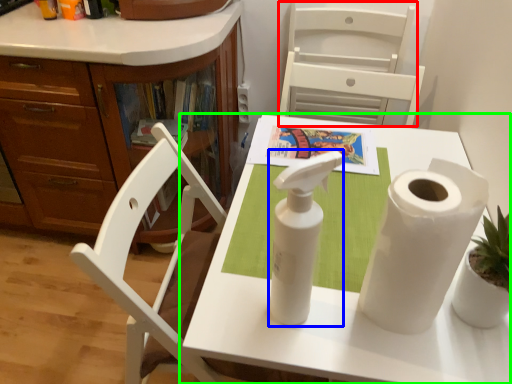
Question: Considering the real-world distances, which object is farthest from armchair (highlighted by a red box)? soap dispenser (highlighted by a blue box) or table (highlighted by a green box)?

Choices:
 (A) soap dispenser
 (B) table

Answer: (A)